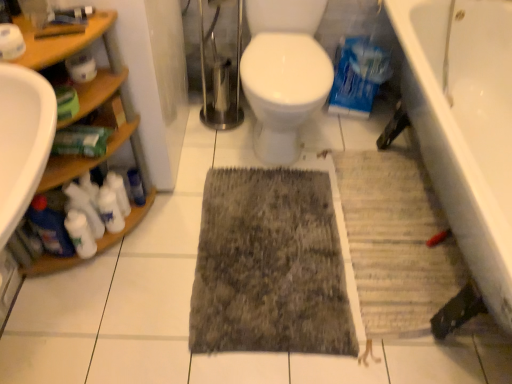
Where is `empty space that is in between dark gray textured rug at center and gray textured bath mat at lower right`? The height and width of the screenshot is (384, 512). empty space that is in between dark gray textured rug at center and gray textured bath mat at lower right is located at coordinates (315, 169).